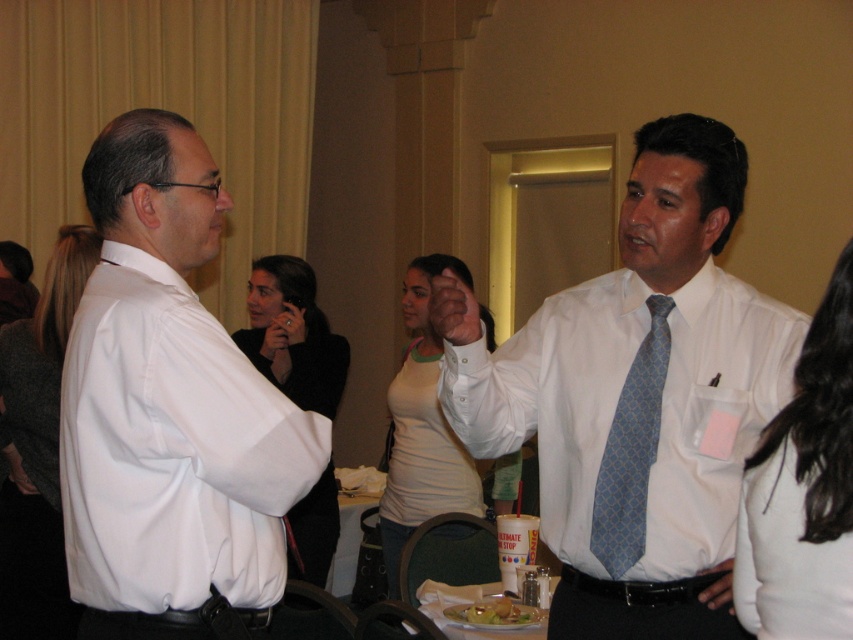
Question: Estimate the real-world distances between objects in this image. Which object is closer to the blue patterned tie at center?

Choices:
 (A) white fabric shirt at right
 (B) white matte tank top at center
 (C) dark gray sweater at center
 (D) black fabric shirt at center

Answer: (A)

Question: Which point is farther to the camera?

Choices:
 (A) (248, 300)
 (B) (846, 368)
 (C) (732, 548)
 (D) (21, 604)

Answer: (A)

Question: Which of these objects is positioned closest to the dark gray sweater at center?

Choices:
 (A) white matte tank top at center
 (B) white fabric shirt at right
 (C) black fabric shirt at center

Answer: (C)

Question: Does white fabric shirt at right appear on the right side of dark gray sweater at center?

Choices:
 (A) yes
 (B) no

Answer: (A)

Question: Can you confirm if white matte tank top at center is bigger than blue patterned tie at center?

Choices:
 (A) no
 (B) yes

Answer: (B)

Question: In this image, where is dark gray sweater at center located relative to black fabric shirt at center?

Choices:
 (A) above
 (B) below

Answer: (B)